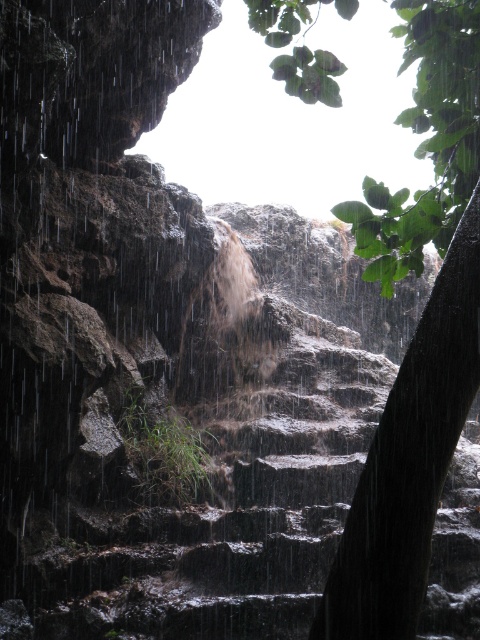
Which of these two, dark stone stairs at center or green leafy tree at upper right, stands taller?

Standing taller between the two is dark stone stairs at center.

Is point (450, 577) positioned after point (458, 81)?

That is True.

Where is `dark stone stairs at center`? dark stone stairs at center is located at coordinates (215, 506).